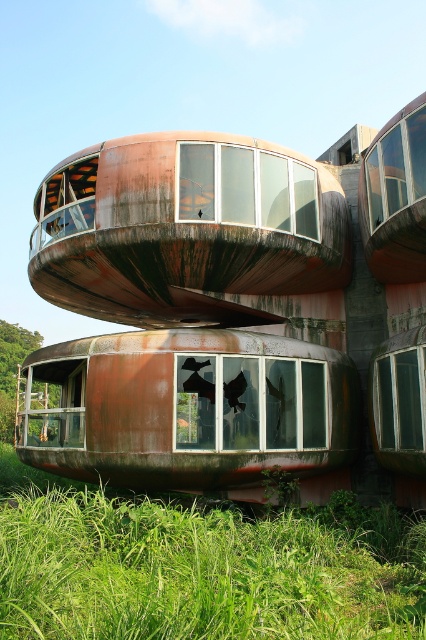
Is point (65, 611) farther from viewer compared to point (270, 371)?

That is False.

Is green grassy at lower left taller than rusty metal train car at lower center?

Indeed, green grassy at lower left has a greater height compared to rusty metal train car at lower center.

The width and height of the screenshot is (426, 640). What do you see at coordinates (201, 566) in the screenshot? I see `green grassy at lower left` at bounding box center [201, 566].

Where is `green grassy at lower left`? green grassy at lower left is located at coordinates (201, 566).